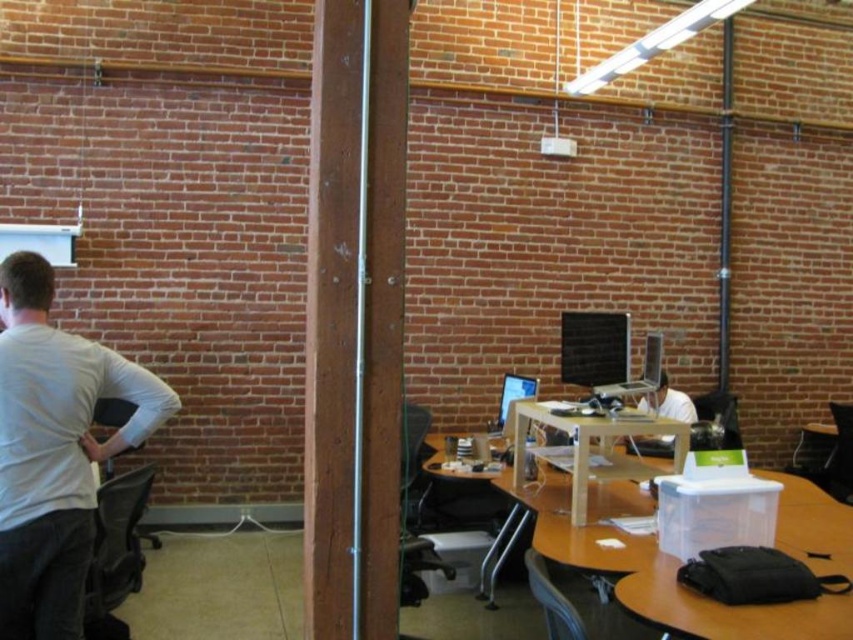
Question: Which point is closer to the camera?

Choices:
 (A) white matte shirt at left
 (B) white matte shirt at center
 (C) light brown wooden table at lower right
 (D) black mesh office chair at left

Answer: (C)

Question: Can you confirm if black mesh office chair at left is wider than silver metallic laptop at center?

Choices:
 (A) no
 (B) yes

Answer: (A)

Question: Is black mesh office chair at left to the right of gray fabric chair at lower right from the viewer's perspective?

Choices:
 (A) yes
 (B) no

Answer: (B)

Question: Is gray fabric chair at lower right positioned at the back of matte black chair at center?

Choices:
 (A) yes
 (B) no

Answer: (A)

Question: Which point is farther to the camera?

Choices:
 (A) (45, 602)
 (B) (401, 536)
 (C) (635, 436)
 (D) (643, 360)

Answer: (D)

Question: Estimate the real-world distances between objects in this image. Which object is farther from the white matte shirt at center?

Choices:
 (A) gray fabric chair at lower right
 (B) matte black chair at center

Answer: (B)